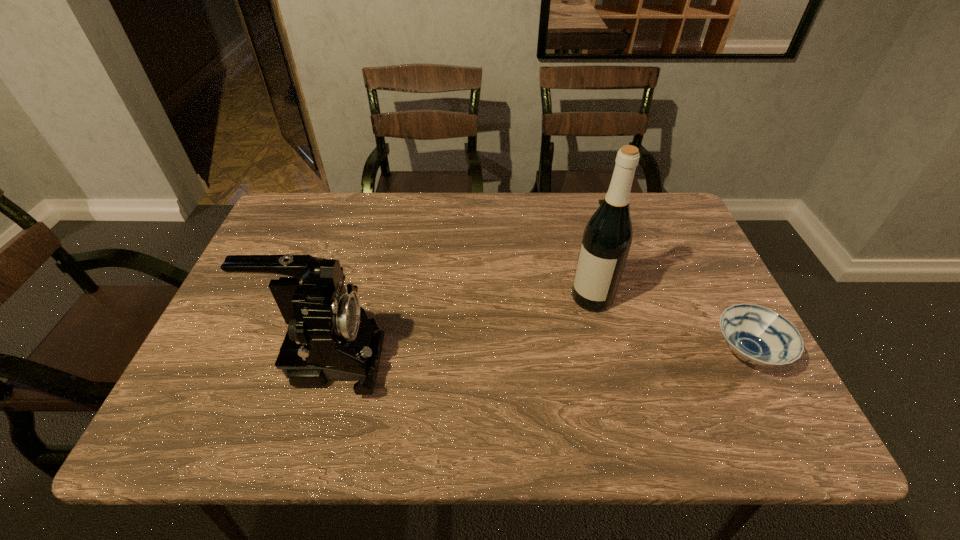
Locate an element on the screen. vacant area that lies between the farthest object and the soup bowl is located at coordinates (675, 284).

In order to click on free space between the soup bowl and the second farthest object in this screenshot , I will do `click(669, 325)`.

I want to click on free space between the camcorder and the sunglasses, so click(467, 286).

Find the location of `empty space that is in between the rightmost object and the farthest object`. empty space that is in between the rightmost object and the farthest object is located at coordinates (675, 284).

In order to click on unoccupied area between the sunglasses and the soup bowl in this screenshot , I will do `click(675, 284)`.

At what (x,y) coordinates should I click in order to perform the action: click on unoccupied area between the soup bowl and the camcorder. Please return your answer as a coordinate pair (x, y). Looking at the image, I should click on (538, 356).

The width and height of the screenshot is (960, 540). What are the coordinates of `empty space between the rightmost object and the tallest object` in the screenshot? It's located at (669, 325).

You are a GUI agent. You are given a task and a screenshot of the screen. Output one action in this format:
    pyautogui.click(x=<x>, y=<y>)
    Task: Click on the unoccupied area between the soup bowl and the camcorder
    
    Given the screenshot: What is the action you would take?
    pyautogui.click(x=538, y=356)

Where is `object that is the second closest to the farthest object`? object that is the second closest to the farthest object is located at coordinates (758, 335).

Identify which object is the third closest to the sunglasses. Please provide its 2D coordinates. Your answer should be formatted as a tuple, i.e. [(x, y)], where the tuple contains the x and y coordinates of a point satisfying the conditions above.

[(330, 338)]